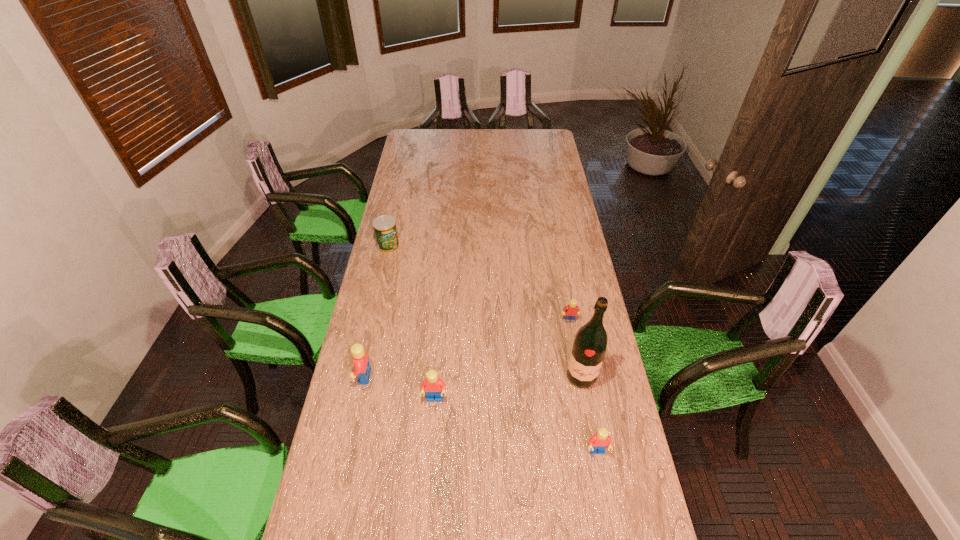
Find the location of a particular element. The image size is (960, 540). Lego that is the second closest to the nearest Lego is located at coordinates (572, 310).

Where is `vacant position in the image that satisfies the following two spatial constraints: 1. on the front-facing side of the farthest Lego; 2. on the face of the leftmost Lego`? This screenshot has height=540, width=960. vacant position in the image that satisfies the following two spatial constraints: 1. on the front-facing side of the farthest Lego; 2. on the face of the leftmost Lego is located at coordinates (580, 376).

Identify the location of free space in the image that satisfies the following two spatial constraints: 1. on the front-facing side of the farthest Lego; 2. on the face of the leftmost Lego. (580, 376).

The height and width of the screenshot is (540, 960). Find the location of `vacant space that satisfies the following two spatial constraints: 1. on the front-facing side of the farthest Lego; 2. on the face of the second farthest Lego`. vacant space that satisfies the following two spatial constraints: 1. on the front-facing side of the farthest Lego; 2. on the face of the second farthest Lego is located at coordinates (580, 376).